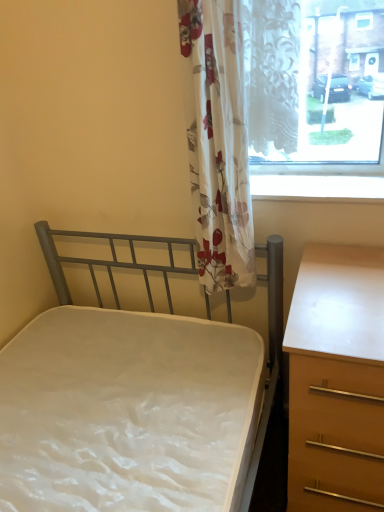
The image size is (384, 512). I want to click on metallic gray bed at center-left, so click(x=269, y=369).

Find the location of a particular element. The image size is (384, 512). floral fabric curtain at center is located at coordinates (219, 140).

The width and height of the screenshot is (384, 512). What do you see at coordinates (336, 380) in the screenshot?
I see `light brown wood chest of drawers at right` at bounding box center [336, 380].

Where is `metallic gray bed at center-left`? The height and width of the screenshot is (512, 384). metallic gray bed at center-left is located at coordinates (269, 369).

Is light brown wood chest of drawers at right inside the boundaries of floral fabric curtain at center, or outside?

light brown wood chest of drawers at right is located beyond the bounds of floral fabric curtain at center.

From a real-world perspective, is light brown wood chest of drawers at right located higher than floral fabric curtain at center?

No, from a real-world perspective, light brown wood chest of drawers at right is not above floral fabric curtain at center.

From the picture: Relative to floral fabric curtain at center, is light brown wood chest of drawers at right in front or behind?

Clearly, light brown wood chest of drawers at right is in front of floral fabric curtain at center.

Is point (359, 201) positioned behind point (277, 303)?

No.

Does white glossy window sill at upper center come behind metallic gray bed at center-left?

Yes.

How distant is white glossy window sill at upper center from metallic gray bed at center-left?

white glossy window sill at upper center is 18.35 inches away from metallic gray bed at center-left.

How many degrees apart are the facing directions of metallic gray bed at center-left and white glossy window sill at upper center?

The angle between the facing direction of metallic gray bed at center-left and the facing direction of white glossy window sill at upper center is 1.5 degrees.

Are metallic gray bed at center-left and white glossy window sill at upper center beside each other?

metallic gray bed at center-left is not next to white glossy window sill at upper center, and they're not touching.

Who is shorter, metallic gray bed at center-left or white glossy window sill at upper center?

Standing shorter between the two is white glossy window sill at upper center.

Considering the points (117, 239) and (278, 178), which point is behind, point (117, 239) or point (278, 178)?

The point (117, 239) is farther from the camera.

Measure the distance from metallic gray bed at center-left to floral fabric curtain at center.

17.27 inches.

Which object is positioned more to the left, metallic gray bed at center-left or floral fabric curtain at center?

metallic gray bed at center-left is more to the left.

Consider the image. Between metallic gray bed at center-left and floral fabric curtain at center, which one has less height?

Standing shorter between the two is floral fabric curtain at center.

From the image's perspective, which object appears higher, metallic gray bed at center-left or floral fabric curtain at center?

floral fabric curtain at center, from the image's perspective.

Between floral fabric curtain at center and light brown wood chest of drawers at right, which one has smaller size?

Smaller between the two is floral fabric curtain at center.

Is floral fabric curtain at center thinner than light brown wood chest of drawers at right?

Indeed, floral fabric curtain at center has a lesser width compared to light brown wood chest of drawers at right.

Considering the relative positions of floral fabric curtain at center and light brown wood chest of drawers at right in the image provided, is floral fabric curtain at center behind light brown wood chest of drawers at right?

That is True.

From the image's perspective, would you say floral fabric curtain at center is positioned over light brown wood chest of drawers at right?

Yes.

Which is correct: floral fabric curtain at center is inside metallic gray bed at center-left, or outside of it?

floral fabric curtain at center is outside metallic gray bed at center-left.

Which of these two, floral fabric curtain at center or metallic gray bed at center-left, is bigger?

With larger size is metallic gray bed at center-left.

Measure the distance from floral fabric curtain at center to metallic gray bed at center-left.

They are 17.27 inches apart.

How different are the orientations of floral fabric curtain at center and metallic gray bed at center-left in degrees?

The angular difference between floral fabric curtain at center and metallic gray bed at center-left is 0.000604 degrees.

Find the location of a particular element. window sill that is under the floral fabric curtain at center (from a real-world perspective) is located at coordinates (318, 188).

From the picture: From a real-world perspective, who is located lower, white glossy window sill at upper center or floral fabric curtain at center?

white glossy window sill at upper center.

Is white glossy window sill at upper center to the left or to the right of floral fabric curtain at center in the image?

From the image, it's evident that white glossy window sill at upper center is to the right of floral fabric curtain at center.

Do you think white glossy window sill at upper center is within floral fabric curtain at center, or outside of it?

white glossy window sill at upper center is not inside floral fabric curtain at center, it's outside.

Locate an element on the screen. Image resolution: width=384 pixels, height=512 pixels. chest of drawers in front of the floral fabric curtain at center is located at coordinates (336, 380).

There is a metallic gray bed at center-left. Find the location of `window sill above it (from a real-world perspective)`. window sill above it (from a real-world perspective) is located at coordinates (318, 188).

Looking at this image, which object lies further to the anchor point white glossy window sill at upper center, floral fabric curtain at center or light brown wood chest of drawers at right?

Among the two, light brown wood chest of drawers at right is located further to white glossy window sill at upper center.

Consider the image. When comparing their distances from white glossy window sill at upper center, does floral fabric curtain at center or metallic gray bed at center-left seem closer?

floral fabric curtain at center is positioned closer to the anchor white glossy window sill at upper center.

Based on their spatial positions, is metallic gray bed at center-left or light brown wood chest of drawers at right closer to white glossy window sill at upper center?

light brown wood chest of drawers at right is closer to white glossy window sill at upper center.

Estimate the real-world distances between objects in this image. Which object is further from white glossy window sill at upper center, metallic gray bed at center-left or floral fabric curtain at center?

The object further to white glossy window sill at upper center is metallic gray bed at center-left.

From the image, which object appears to be farther from white glossy window sill at upper center, light brown wood chest of drawers at right or metallic gray bed at center-left?

The object further to white glossy window sill at upper center is metallic gray bed at center-left.

Based on the photo, based on their spatial positions, is white glossy window sill at upper center or metallic gray bed at center-left closer to light brown wood chest of drawers at right?

metallic gray bed at center-left lies closer to light brown wood chest of drawers at right than the other object.

Based on their spatial positions, is floral fabric curtain at center or white glossy window sill at upper center closer to metallic gray bed at center-left?

The object closer to metallic gray bed at center-left is floral fabric curtain at center.

When comparing their distances from light brown wood chest of drawers at right, does floral fabric curtain at center or white glossy window sill at upper center seem further?

Among the two, floral fabric curtain at center is located further to light brown wood chest of drawers at right.

Locate an element on the screen. chest of drawers between floral fabric curtain at center and metallic gray bed at center-left in the vertical direction is located at coordinates (336, 380).

Find the location of a particular element. This screenshot has width=384, height=512. window sill between floral fabric curtain at center and light brown wood chest of drawers at right in the vertical direction is located at coordinates (318, 188).

What are the coordinates of `window sill between floral fabric curtain at center and metallic gray bed at center-left vertically` in the screenshot? It's located at (318, 188).

Locate an element on the screen. chest of drawers between white glossy window sill at upper center and metallic gray bed at center-left from top to bottom is located at coordinates (336, 380).